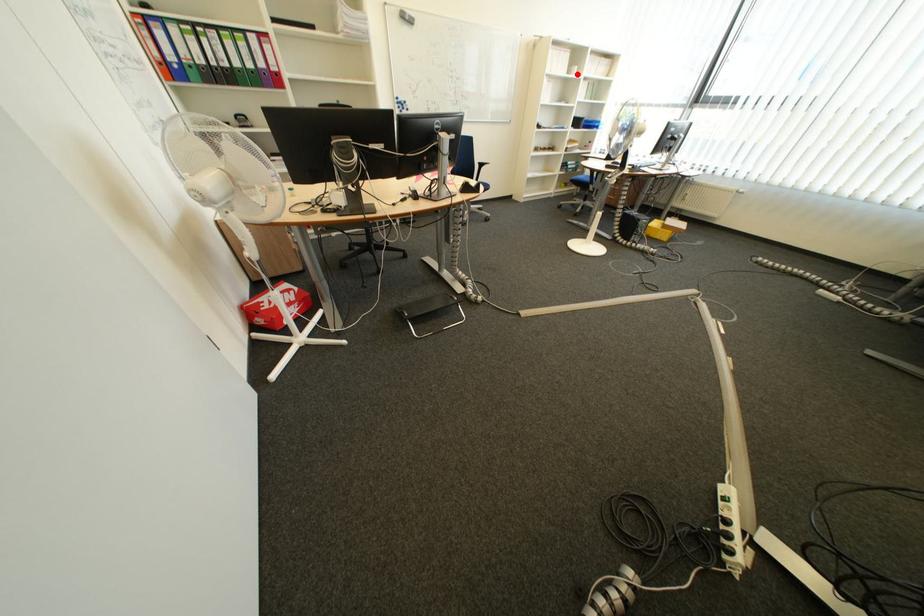
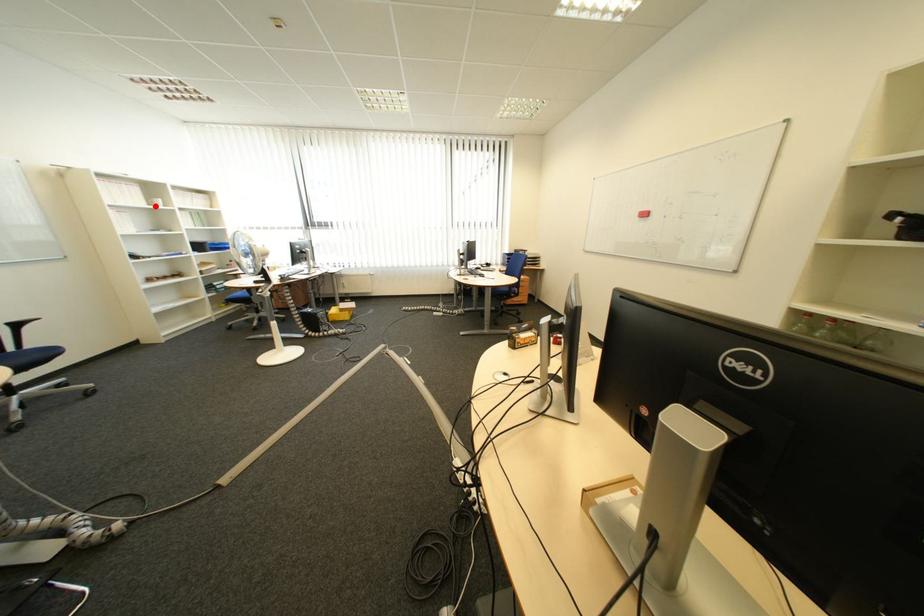
I am providing you with two images of the same scene from different viewpoints. A red point is marked on the first image and another point is marked on the second image. Is the marked point in image1 the same physical position as the marked point in image2?

Yes